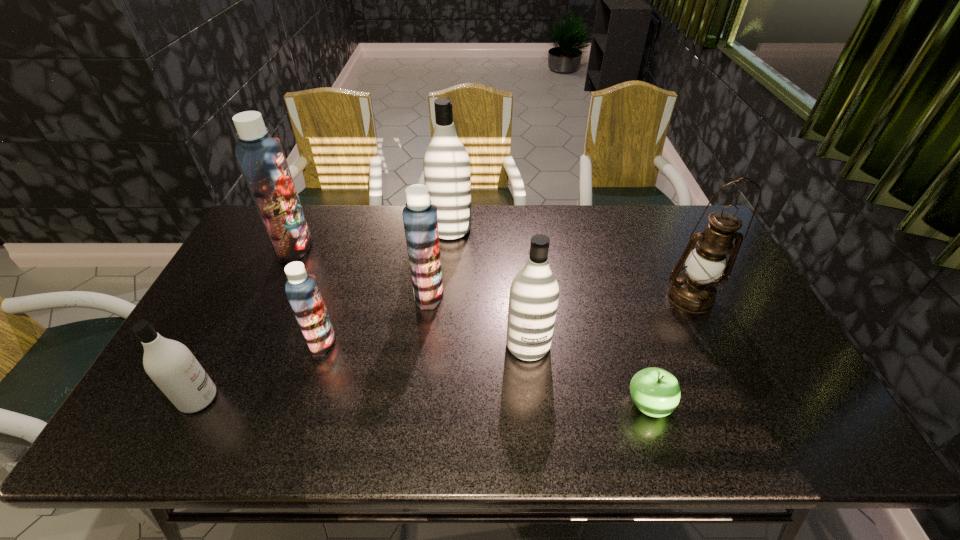
You are a GUI agent. You are given a task and a screenshot of the screen. Output one action in this format:
    pyautogui.click(x=<x>, y=<y>)
    Task: Click on the farthest white shampoo
    This screenshot has width=960, height=540.
    Given the screenshot: What is the action you would take?
    pyautogui.click(x=447, y=173)

Find the location of a particular element. Image resolution: width=960 pixels, height=540 pixels. the second white shampoo from right to left is located at coordinates (447, 173).

Locate an element on the screen. the biggest blue shampoo is located at coordinates (261, 158).

The height and width of the screenshot is (540, 960). Find the location of `the farthest blue shampoo`. the farthest blue shampoo is located at coordinates (261, 158).

Where is `the rightmost object`? This screenshot has height=540, width=960. the rightmost object is located at coordinates (695, 291).

The height and width of the screenshot is (540, 960). In order to click on brown oil lamp in this screenshot , I will do `click(695, 291)`.

In order to click on the rightmost blue shampoo in this screenshot , I will do `click(420, 220)`.

Image resolution: width=960 pixels, height=540 pixels. Identify the location of the second farthest blue shampoo. (420, 220).

Where is `the rightmost shampoo`? the rightmost shampoo is located at coordinates (534, 292).

Where is `the third object from right to left`? This screenshot has width=960, height=540. the third object from right to left is located at coordinates (534, 292).